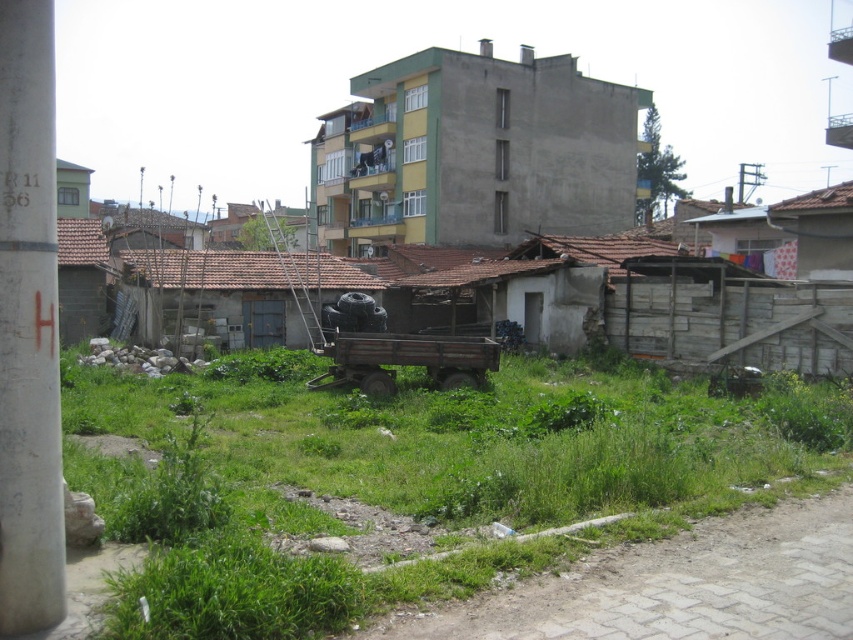
You are a delivery person trying to park your truck near the rustic wooden wagon at center without blocking the green matte hut at upper left. Is there enough space between them to park?

The rustic wooden wagon at center is positioned under the green matte hut at upper left, so there is no space between them to park the truck without blocking the hut.

You are a delivery person trying to navigate through the urban area shown. You need to pass between the rustic wooden wagon at center and the green matte hut at upper left. Can your delivery van, which is 2 meters wide, fit through the space between them?

The rustic wooden wagon at center is thinner than the green matte hut at upper left. However, the exact width of the space between them isn